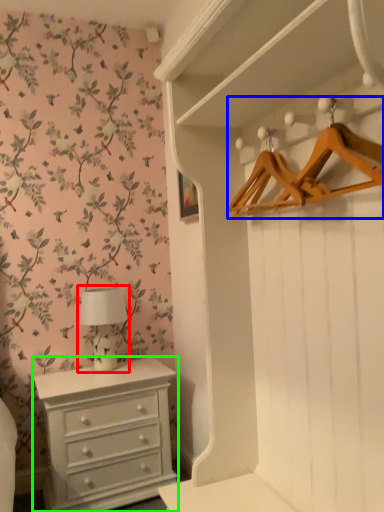
Question: Based on their relative distances, which object is farther from table lamp (highlighted by a red box)? Choose from hanger (highlighted by a blue box) and chest of drawers (highlighted by a green box).

Choices:
 (A) hanger
 (B) chest of drawers

Answer: (A)